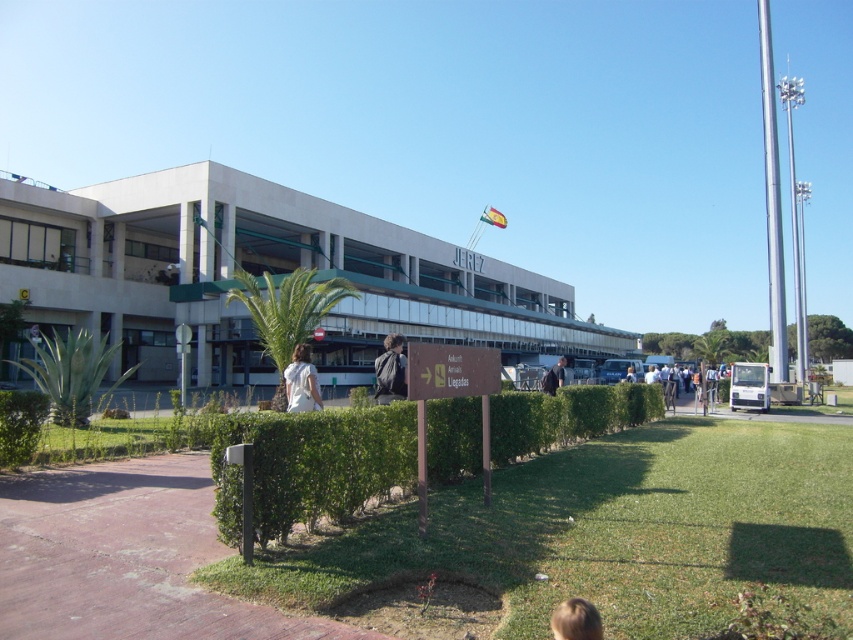
You are a traveler who just arrived at the JEREZ airport terminal. You notice a matte black backpack at center and dark blue jeans at center. Which item is located higher up?

The matte black backpack at center is positioned over the dark blue jeans at center, so it is located higher up.

You are standing in front of the JEREZ airport terminal building and need to find the matte black backpack at center. According to the airport map, the backpack is located at coordinates 0.580, 0.458. If you are facing the building, which direction should you walk to reach the backpack?

The matte black backpack at center is located at coordinates (x=390, y=371), so you should walk towards the center of the building to reach it.

You are a traveler at the JEREZ airport terminal and you see a person wearing a white fabric shirt at lower center and dark blue jeans at center. Which clothing item appears smaller in size?

The white fabric shirt at lower center appears smaller in size compared to the dark blue jeans at center.